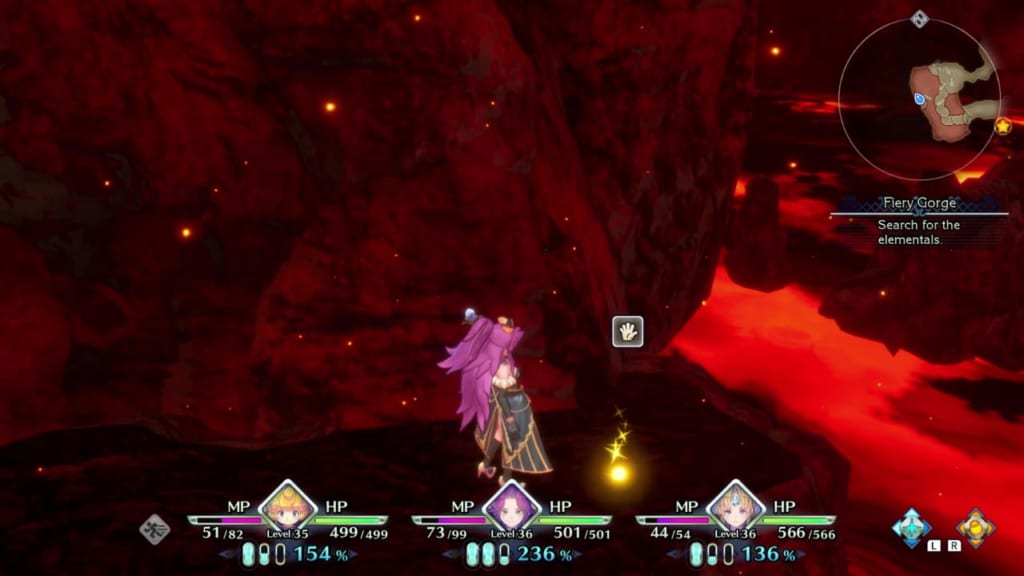
Locate an element on the screen. This screenshot has width=1024, height=576. gold vertical stripes is located at coordinates (538, 453), (531, 454), (521, 460), (540, 464), (526, 425).